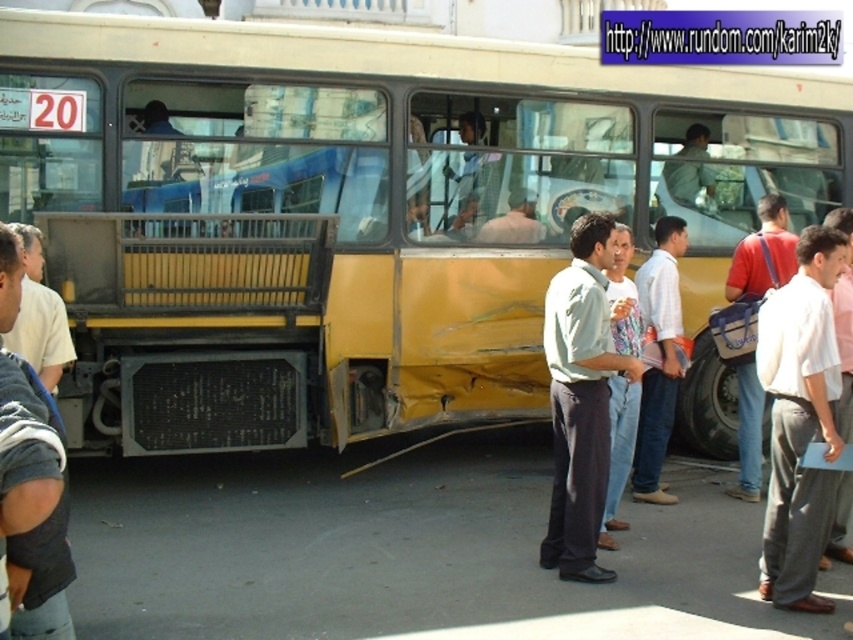
Measure the distance between point (643,356) and camera.

Point (643,356) and camera are 22.00 feet apart from each other.

Describe the element at coordinates (659, 356) in the screenshot. I see `white shirt at center` at that location.

Is point (664, 449) behind point (773, 241)?

No, it is not.

Find the location of a particular element. Image resolution: width=853 pixels, height=640 pixels. white shirt at center is located at coordinates (659, 356).

Does point (677, 349) come in front of point (700, 173)?

Yes, point (677, 349) is closer to viewer.

Can you confirm if white shirt at center is positioned below light green shirt at center?

Yes.

Is point (645, 284) farther from camera compared to point (697, 156)?

No, it is in front of (697, 156).

The height and width of the screenshot is (640, 853). What are the coordinates of `white shirt at center` in the screenshot? It's located at (659, 356).

Is light green fabric shirt at center taller than light gray striped shirt at center?

Correct, light green fabric shirt at center is much taller as light gray striped shirt at center.

From the picture: Can you confirm if light green fabric shirt at center is wider than light gray striped shirt at center?

Yes.

You are a GUI agent. You are given a task and a screenshot of the screen. Output one action in this format:
    pyautogui.click(x=<x>, y=<y>)
    Task: Click on the light green fabric shirt at center
    
    Given the screenshot: What is the action you would take?
    pyautogui.click(x=581, y=397)